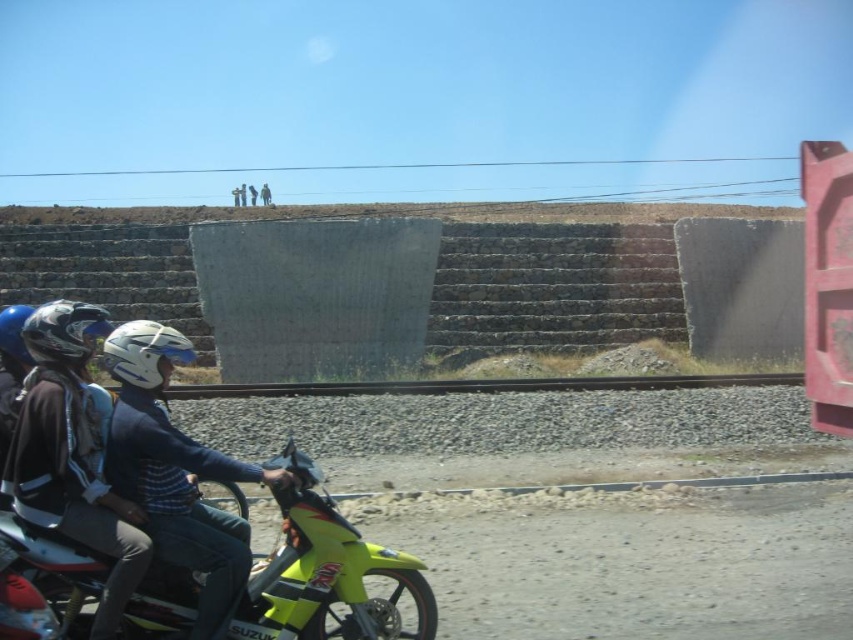
From the picture: Measure the distance between matte black helmet at left and blue matte helmet at left.

They are 54.88 centimeters apart.

Locate an element on the screen. matte black helmet at left is located at coordinates (64, 332).

Does neon yellow plastic motorcycle at lower left appear under white matte helmet at center?

Yes.

Is neon yellow plastic motorcycle at lower left wider than white matte helmet at center?

Incorrect, neon yellow plastic motorcycle at lower left's width does not surpass white matte helmet at center's.

Where is `neon yellow plastic motorcycle at lower left`? The height and width of the screenshot is (640, 853). neon yellow plastic motorcycle at lower left is located at coordinates (326, 572).

Can you confirm if neon yellow plastic motorcycle at lower left is positioned above blue matte helmet at left?

No.

Which is in front, point (267, 556) or point (0, 310)?

Point (267, 556)

Where is `neon yellow plastic motorcycle at lower left`? neon yellow plastic motorcycle at lower left is located at coordinates (326, 572).